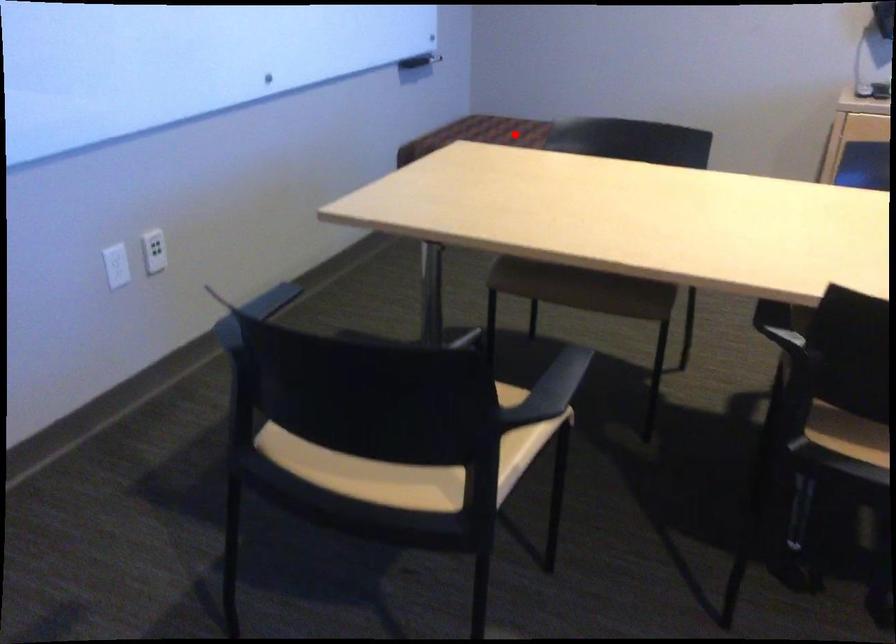
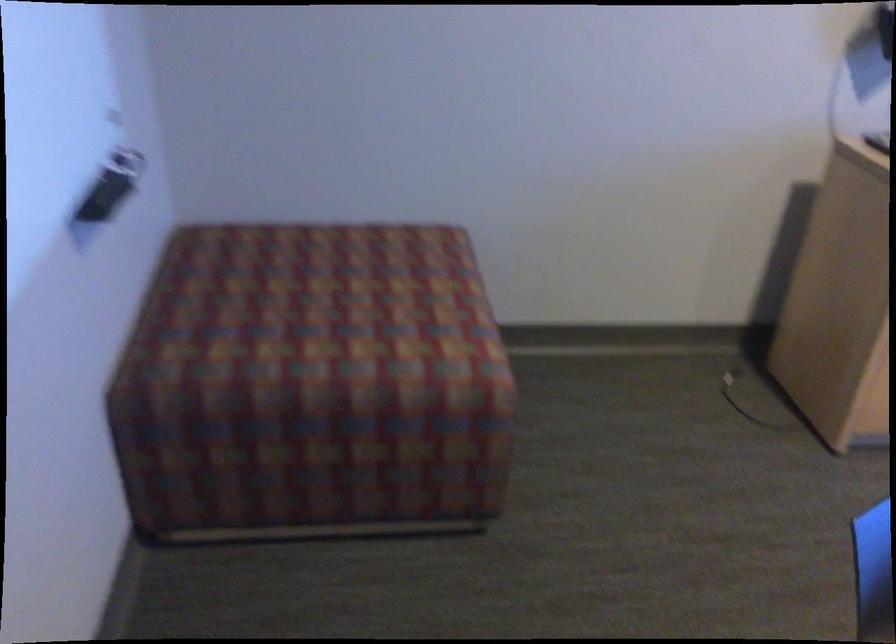
Question: I am providing you with two images of the same scene from different viewpoints. A red point is shown in image1. For the corresponding object point in image2, is it positioned nearer or farther from the camera?

Choices:
 (A) Nearer
 (B) Farther

Answer: (A)